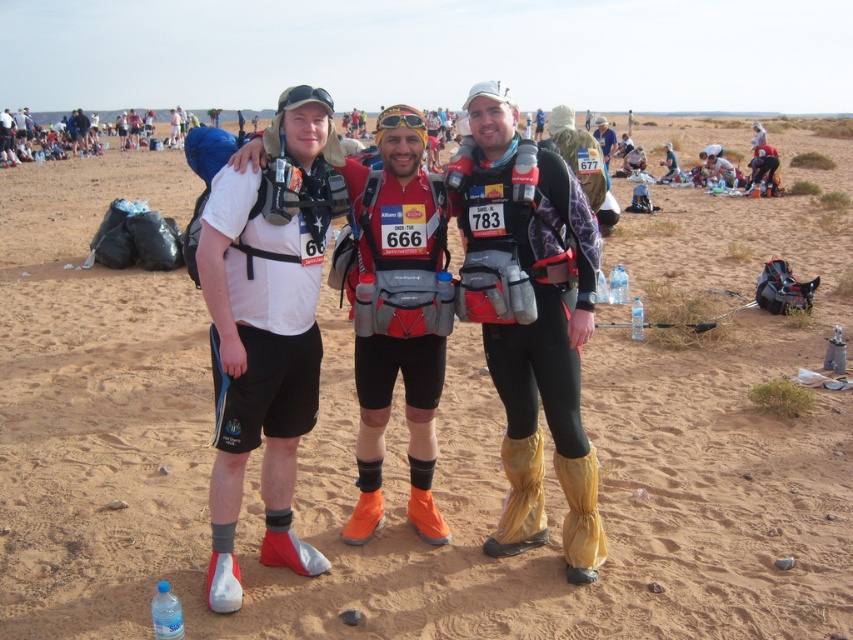
Between matte black pants at center and white matte shorts at center, which one appears on the right side from the viewer's perspective?

matte black pants at center

Can you confirm if matte black pants at center is wider than white matte shorts at center?

No.

Is point (560, 300) less distant than point (233, 490)?

No, (560, 300) is behind (233, 490).

The height and width of the screenshot is (640, 853). What are the coordinates of `matte black pants at center` in the screenshot? It's located at (531, 317).

Is matte black pants at center to the right of shiny gold sunglasses at center from the viewer's perspective?

Indeed, matte black pants at center is positioned on the right side of shiny gold sunglasses at center.

What do you see at coordinates (531, 317) in the screenshot? I see `matte black pants at center` at bounding box center [531, 317].

Which is in front, point (517, 332) or point (408, 125)?

Point (408, 125) is more forward.

You are a GUI agent. You are given a task and a screenshot of the screen. Output one action in this format:
    pyautogui.click(x=<x>, y=<y>)
    Task: Click on the matte black pants at center
    
    Given the screenshot: What is the action you would take?
    pyautogui.click(x=531, y=317)

Can you confirm if white matte shorts at center is shorter than shiny gold sunglasses at center?

Indeed, white matte shorts at center has a lesser height compared to shiny gold sunglasses at center.

Between point (267, 224) and point (422, 125), which one is positioned in front?

Point (267, 224) is in front.

Locate an element on the screen. This screenshot has height=640, width=853. white matte shorts at center is located at coordinates (265, 333).

Find the location of a particular element. white matte shorts at center is located at coordinates (265, 333).